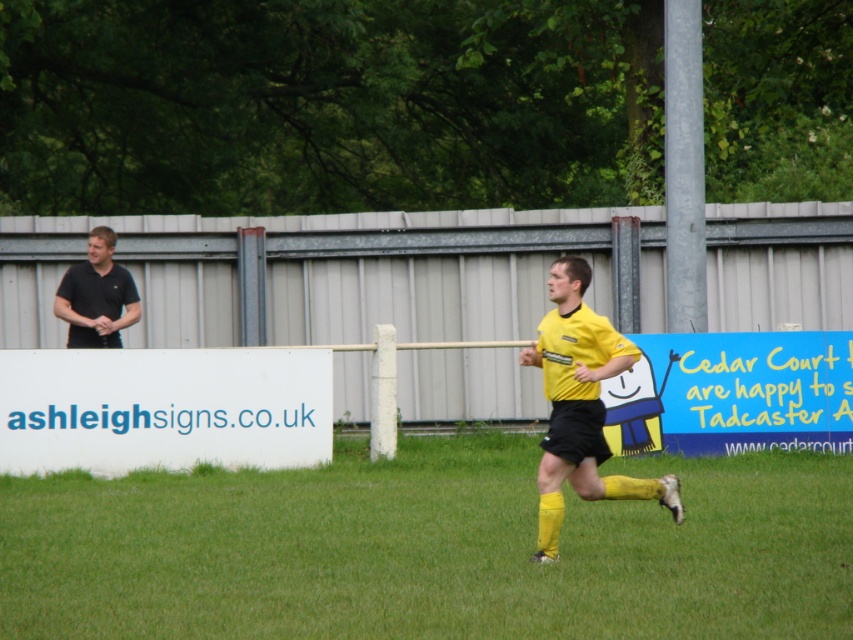
Question: Can you confirm if green grass at center is smaller than yellow matte jersey at center?

Choices:
 (A) no
 (B) yes

Answer: (B)

Question: Is green grass at center positioned at the back of black smooth shirt at left?

Choices:
 (A) yes
 (B) no

Answer: (B)

Question: Estimate the real-world distances between objects in this image. Which object is closer to the yellow matte jersey at center?

Choices:
 (A) black smooth shirt at left
 (B) green grass at center

Answer: (B)

Question: Can you confirm if green grass at center is wider than yellow matte jersey at center?

Choices:
 (A) yes
 (B) no

Answer: (A)

Question: Which object is closer to the camera taking this photo?

Choices:
 (A) green grass at center
 (B) yellow matte jersey at center

Answer: (B)

Question: Which point is farther to the camera?

Choices:
 (A) yellow matte jersey at center
 (B) green grass at center
 (C) black smooth shirt at left

Answer: (C)